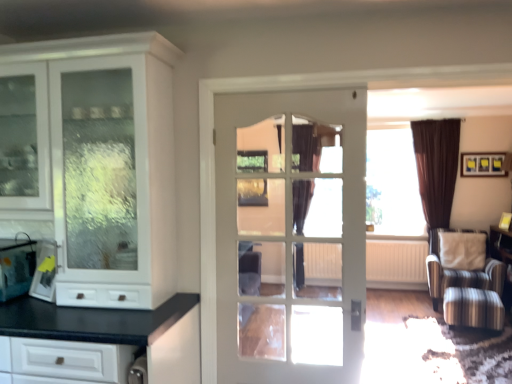
Describe the element at coordinates (105, 164) in the screenshot. Image resolution: width=512 pixels, height=384 pixels. I see `white glossy cabinet at left` at that location.

This screenshot has width=512, height=384. Find the location of `yellow plastic bag at left, placed as the first appliance when sorted from right to left`. yellow plastic bag at left, placed as the first appliance when sorted from right to left is located at coordinates (45, 273).

What do you see at coordinates (306, 148) in the screenshot? Image resolution: width=512 pixels, height=384 pixels. I see `black velvet curtain at center` at bounding box center [306, 148].

You are a GUI agent. You are given a task and a screenshot of the screen. Output one action in this format:
    pyautogui.click(x=<x>, y=<y>)
    Task: Click on the white textured radiator at center
    
    Given the screenshot: What is the action you would take?
    pyautogui.click(x=396, y=264)

In order to face beige fabric pillow at right, should I rotate leftwards or rightwards?

Turn right approximately 26.371 degrees to face it.

This screenshot has height=384, width=512. Describe the element at coordinates (462, 250) in the screenshot. I see `beige fabric pillow at right` at that location.

The image size is (512, 384). In order to click on metallic silver bag at left, the 2th appliance from the right in this screenshot , I will do `click(16, 268)`.

This screenshot has height=384, width=512. What are the coordinates of `white glossy cabinet at left` in the screenshot? It's located at (105, 164).

From the picture: Which of these two, striped fabric armchair at right or metallic silver bag at left, arranged as the 1th appliance when viewed from the left, is wider?

With larger width is striped fabric armchair at right.

Which of these two, striped fabric armchair at right or metallic silver bag at left, the 2th appliance from the right, is smaller?

Smaller between the two is metallic silver bag at left, the 2th appliance from the right.

In terms of height, does striped fabric armchair at right look taller or shorter compared to metallic silver bag at left, the 2th appliance from the right?

In the image, striped fabric armchair at right appears to be taller than metallic silver bag at left, the 2th appliance from the right.

Looking at this image, would you say white glossy cabinet at left is outside beige fabric pillow at right?

Indeed, white glossy cabinet at left is completely outside beige fabric pillow at right.

How far apart are white glossy cabinet at left and beige fabric pillow at right?

The distance of white glossy cabinet at left from beige fabric pillow at right is 4.62 meters.

From a real-world perspective, which object stands above the other?

In real-world perspective, white glossy cabinet at left is above.

Considering the relative sizes of white glossy cabinet at left and beige fabric pillow at right in the image provided, is white glossy cabinet at left wider than beige fabric pillow at right?

Yes.

From the image's perspective, is metallic silver bag at left, arranged as the 1th appliance when viewed from the left, above or below white glossy cabinet at left?

Based on their image positions, metallic silver bag at left, arranged as the 1th appliance when viewed from the left, is located beneath white glossy cabinet at left.

From a real-world perspective, is metallic silver bag at left, arranged as the 1th appliance when viewed from the left, positioned above or below white glossy cabinet at left?

metallic silver bag at left, arranged as the 1th appliance when viewed from the left, is situated lower than white glossy cabinet at left in the real world.

Can you confirm if metallic silver bag at left, arranged as the 1th appliance when viewed from the left, is positioned to the right of white glossy cabinet at left?

Incorrect, metallic silver bag at left, arranged as the 1th appliance when viewed from the left, is not on the right side of white glossy cabinet at left.

Are beige fabric pillow at right and white glass door at center located far from each other?

Yes.

From the image's perspective, is beige fabric pillow at right above or below white glass door at center?

Clearly, from the image's perspective, beige fabric pillow at right is below white glass door at center.

Is white glass door at center surrounded by beige fabric pillow at right?

Actually, white glass door at center is outside beige fabric pillow at right.

Measure the distance from beige fabric pillow at right to white glass door at center.

beige fabric pillow at right is 3.31 meters from white glass door at center.

From a real-world perspective, between striped fabric armchair at right and white glossy cabinet at left, who is vertically higher?

From a 3D spatial view, white glossy cabinet at left is above.

Considering the sizes of striped fabric armchair at right and white glossy cabinet at left in the image, is striped fabric armchair at right wider or thinner than white glossy cabinet at left?

Clearly, striped fabric armchair at right has more width compared to white glossy cabinet at left.

How different are the orientations of striped fabric armchair at right and white glossy cabinet at left in degrees?

striped fabric armchair at right and white glossy cabinet at left are facing 0.794 degrees away from each other.

Looking at this image, between metallic silver bag at left, the 2th appliance from the right, and white textured radiator at center, which one appears on the right side from the viewer's perspective?

white textured radiator at center is more to the right.

Is metallic silver bag at left, the 2th appliance from the right, not inside white textured radiator at center?

metallic silver bag at left, the 2th appliance from the right, lies outside white textured radiator at center's area.

Is metallic silver bag at left, arranged as the 1th appliance when viewed from the left, shorter than white textured radiator at center?

Indeed, metallic silver bag at left, arranged as the 1th appliance when viewed from the left, has a lesser height compared to white textured radiator at center.

Is metallic silver bag at left, arranged as the 1th appliance when viewed from the left, facing away from white textured radiator at center?

No, white textured radiator at center is not at the back of metallic silver bag at left, arranged as the 1th appliance when viewed from the left.

In the image, is beige fabric pillow at right positioned in front of or behind white glossy cabinet at left?

beige fabric pillow at right is positioned farther from the viewer than white glossy cabinet at left.

Is beige fabric pillow at right wider than white glossy cabinet at left?

In fact, beige fabric pillow at right might be narrower than white glossy cabinet at left.

From the picture: Which is closer, (441, 234) or (84, 277)?

The point (84, 277) is closer.

Find the location of a particular element. This screenshot has height=384, width=512. chair on the right of metallic silver bag at left, the 2th appliance from the right is located at coordinates (460, 270).

This screenshot has height=384, width=512. I want to click on pillow lying behind the white glossy cabinet at left, so click(x=462, y=250).

Looking at the image, which one is located further to white glass door at center, striped fabric armchair at right or black velvet curtain at center?

Based on the image, striped fabric armchair at right appears to be further to white glass door at center.

Which object lies nearer to the anchor point white glossy cabinet at left, striped fabric armchair at right or beige fabric pillow at right?

striped fabric armchair at right is positioned closer to the anchor white glossy cabinet at left.

Estimate the real-world distances between objects in this image. Which object is closer to black velvet curtain at center, white glass door at center or white textured radiator at center?

white textured radiator at center is closer to black velvet curtain at center.

Which object lies nearer to the anchor point white glossy cabinet at left, beige fabric pillow at right or metallic silver bag at left, the 2th appliance from the right?

The object closer to white glossy cabinet at left is metallic silver bag at left, the 2th appliance from the right.

Estimate the real-world distances between objects in this image. Which object is further from striped fabric armchair at right, black velvet curtain at center or metallic silver bag at left, the 2th appliance from the right?

The object further to striped fabric armchair at right is metallic silver bag at left, the 2th appliance from the right.

Estimate the real-world distances between objects in this image. Which object is further from black velvet curtain at center, striped fabric armchair at right or beige fabric pillow at right?

beige fabric pillow at right.

When comparing their distances from white glass door at center, does metallic silver bag at left, the 2th appliance from the right, or striped fabric armchair at right seem further?

striped fabric armchair at right is further to white glass door at center.

Which object lies nearer to the anchor point white glass door at center, white glossy cabinet at left or white textured radiator at center?

white glossy cabinet at left is positioned closer to the anchor white glass door at center.

Where is `pillow between white glossy cabinet at left and striped fabric armchair at right`? The height and width of the screenshot is (384, 512). pillow between white glossy cabinet at left and striped fabric armchair at right is located at coordinates (462, 250).

Locate an element on the screen. The width and height of the screenshot is (512, 384). chair between white glass door at center and white textured radiator at center in the front-back direction is located at coordinates (460, 270).

The image size is (512, 384). I want to click on pillow between yellow plastic bag at left, the second appliance positioned from the left, and striped fabric armchair at right, so [462, 250].

I want to click on door between yellow plastic bag at left, the second appliance positioned from the left, and beige fabric pillow at right, so click(x=289, y=236).